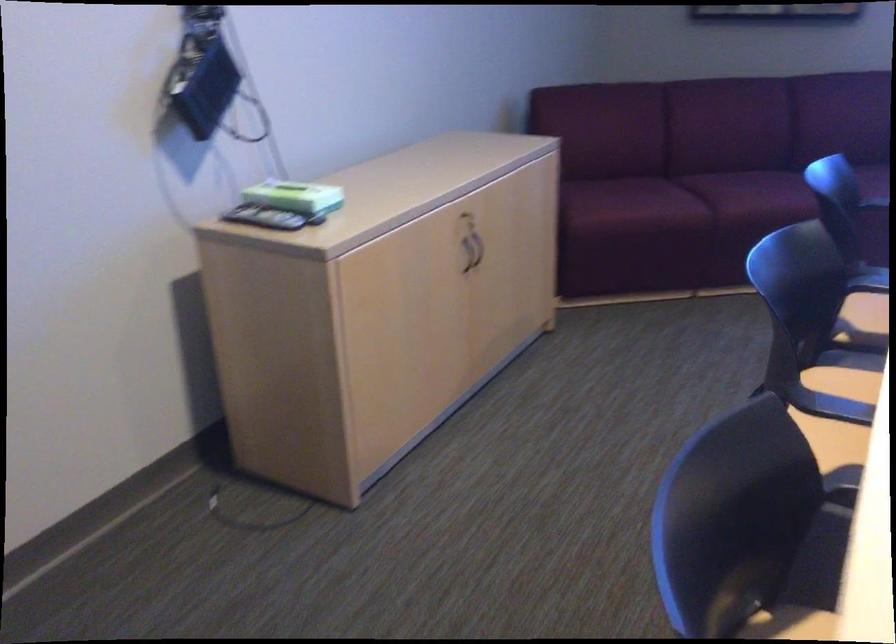
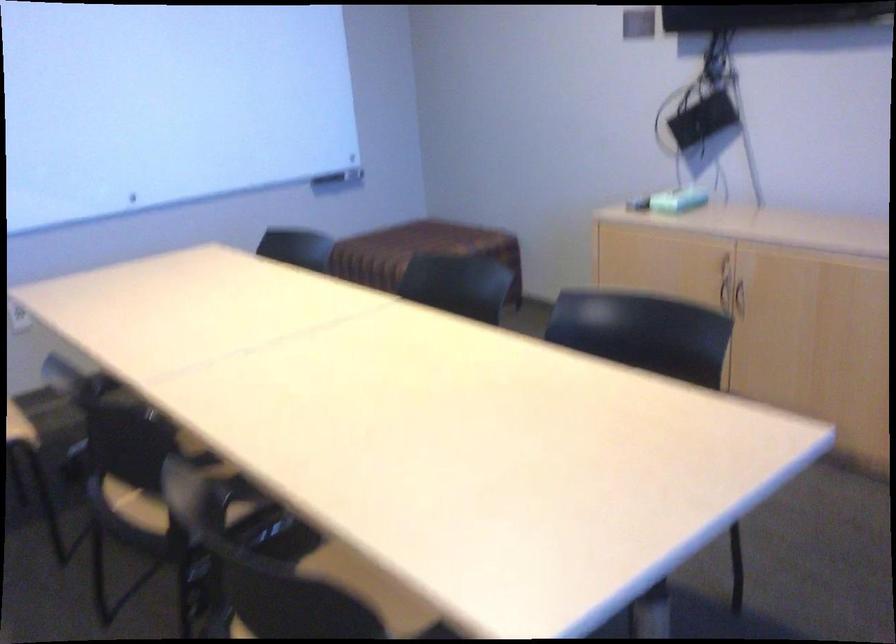
Find the pixel in the second image that matches point (306, 203) in the first image.

(677, 200)